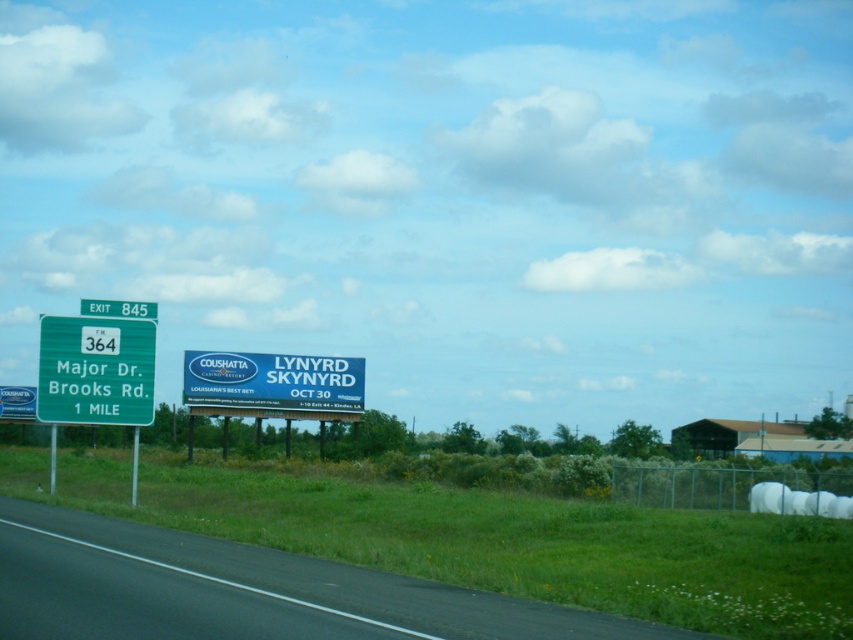
Is point (534, 604) closer to viewer compared to point (83, 342)?

Yes, it is.

Which is below, black asphalt road at lower left or green metallic sign at upper left?

Positioned lower is black asphalt road at lower left.

Does point (61, 560) come in front of point (151, 355)?

Yes, it is in front of point (151, 355).

You are a GUI agent. You are given a task and a screenshot of the screen. Output one action in this format:
    pyautogui.click(x=<x>, y=<y>)
    Task: Click on the black asphalt road at lower left
    Image resolution: width=853 pixels, height=640 pixels.
    Given the screenshot: What is the action you would take?
    pyautogui.click(x=242, y=592)